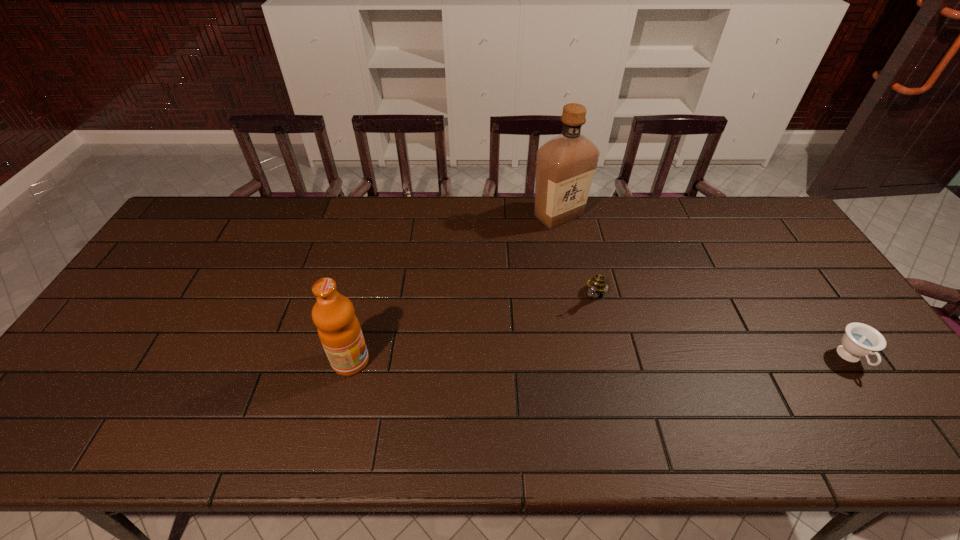
Find the location of `object at the near right corner`. object at the near right corner is located at coordinates click(x=860, y=340).

Locate an element on the screen. The image size is (960, 540). free spot at the far edge of the desktop is located at coordinates (534, 200).

Where is `free spot at the near edge of the desktop`? This screenshot has height=540, width=960. free spot at the near edge of the desktop is located at coordinates (654, 382).

Locate an element on the screen. Image resolution: width=960 pixels, height=540 pixels. vacant space at the right edge is located at coordinates (816, 295).

Identify the location of vacant region between the third shortest object and the liquor. The height and width of the screenshot is (540, 960). (454, 288).

The height and width of the screenshot is (540, 960). I want to click on vacant space that's between the tallest object and the fruit juice, so click(454, 288).

In order to click on vacant space that is in between the farthest object and the shortest object in this screenshot , I will do `click(705, 287)`.

Where is `vacant area that lies between the third nearest object and the tallest object`? vacant area that lies between the third nearest object and the tallest object is located at coordinates (576, 256).

In order to click on free spot between the shortest object and the snail in this screenshot , I will do `click(723, 327)`.

Identify the location of blank region between the second tallest object and the teacup. The image size is (960, 540). (x=601, y=360).